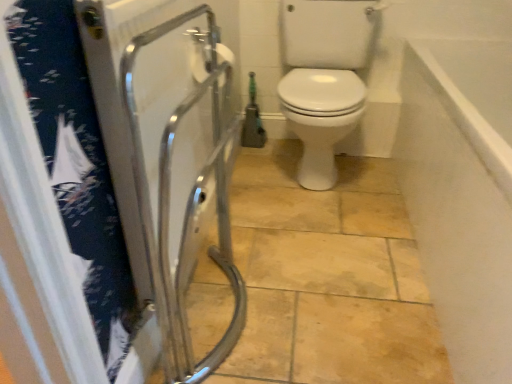
Question: Is white smooth wall at upper right inside white matte toilet paper at upper center?

Choices:
 (A) yes
 (B) no

Answer: (B)

Question: Is white matte toilet paper at upper center turned away from white smooth wall at upper right?

Choices:
 (A) no
 (B) yes

Answer: (A)

Question: Considering the relative sizes of white matte toilet paper at upper center and white smooth wall at upper right in the image provided, is white matte toilet paper at upper center bigger than white smooth wall at upper right?

Choices:
 (A) yes
 (B) no

Answer: (B)

Question: From a real-world perspective, is white matte toilet paper at upper center positioned under white smooth wall at upper right based on gravity?

Choices:
 (A) yes
 (B) no

Answer: (B)

Question: From the image's perspective, is white matte toilet paper at upper center under white smooth wall at upper right?

Choices:
 (A) no
 (B) yes

Answer: (A)

Question: Is white matte toilet paper at upper center outside white smooth wall at upper right?

Choices:
 (A) yes
 (B) no

Answer: (A)

Question: Is transparent plastic screen door at left wider than white smooth wall at upper right?

Choices:
 (A) yes
 (B) no

Answer: (B)

Question: From the image's perspective, is transparent plastic screen door at left above white smooth wall at upper right?

Choices:
 (A) yes
 (B) no

Answer: (B)

Question: Is there a large distance between transparent plastic screen door at left and white smooth wall at upper right?

Choices:
 (A) no
 (B) yes

Answer: (A)

Question: Can you confirm if transparent plastic screen door at left is thinner than white smooth wall at upper right?

Choices:
 (A) no
 (B) yes

Answer: (B)

Question: From a real-world perspective, is transparent plastic screen door at left below white smooth wall at upper right?

Choices:
 (A) yes
 (B) no

Answer: (B)

Question: Considering the relative positions of transparent plastic screen door at left and white smooth wall at upper right in the image provided, is transparent plastic screen door at left behind white smooth wall at upper right?

Choices:
 (A) no
 (B) yes

Answer: (A)

Question: Is transparent plastic screen door at left positioned before white matte toilet paper at upper center?

Choices:
 (A) no
 (B) yes

Answer: (B)